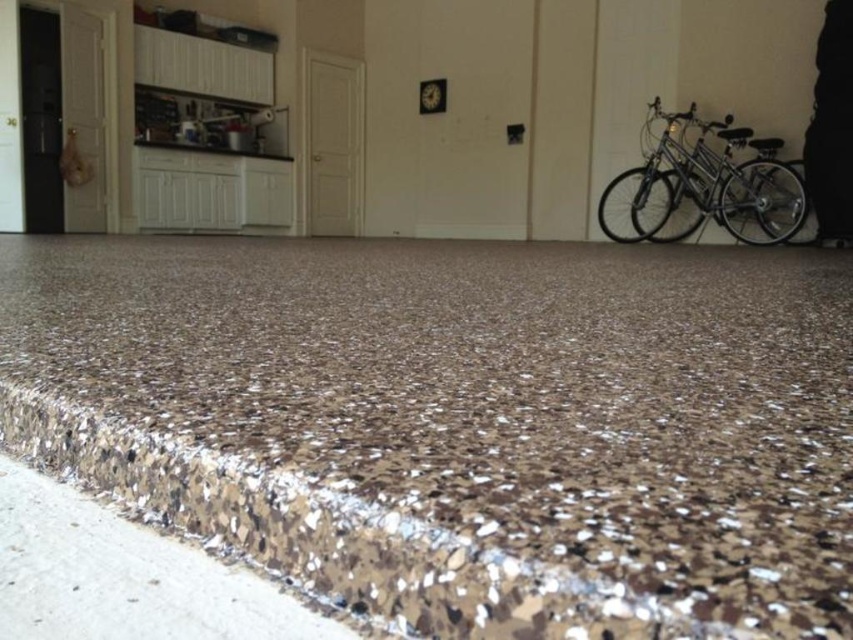
Question: Which point is closer to the camera?

Choices:
 (A) (730, 168)
 (B) (178, 576)

Answer: (B)

Question: Is brown speckled concrete at lower left positioned in front of silver metallic bicycle at right?

Choices:
 (A) yes
 (B) no

Answer: (A)

Question: Does shiny metallic granite at center come in front of brown speckled granite counter top at upper left?

Choices:
 (A) yes
 (B) no

Answer: (A)

Question: From the image, what is the correct spatial relationship of brown speckled concrete at lower left in relation to silver metallic bicycle at right?

Choices:
 (A) left
 (B) right

Answer: (A)

Question: Which of these objects is positioned closest to the brown speckled granite counter top at upper left?

Choices:
 (A) shiny metallic granite at center
 (B) silver metallic bicycle at right
 (C) brown speckled concrete at lower left

Answer: (B)

Question: Which of the following is the closest to the observer?

Choices:
 (A) brown speckled concrete at lower left
 (B) shiny metallic granite at center

Answer: (B)